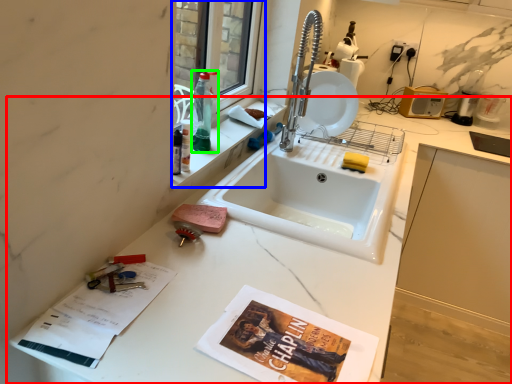
Question: Which object is the farthest from countertop (highlighted by a red box)? Choose among these: window (highlighted by a blue box) or bottle (highlighted by a green box).

Choices:
 (A) window
 (B) bottle

Answer: (A)